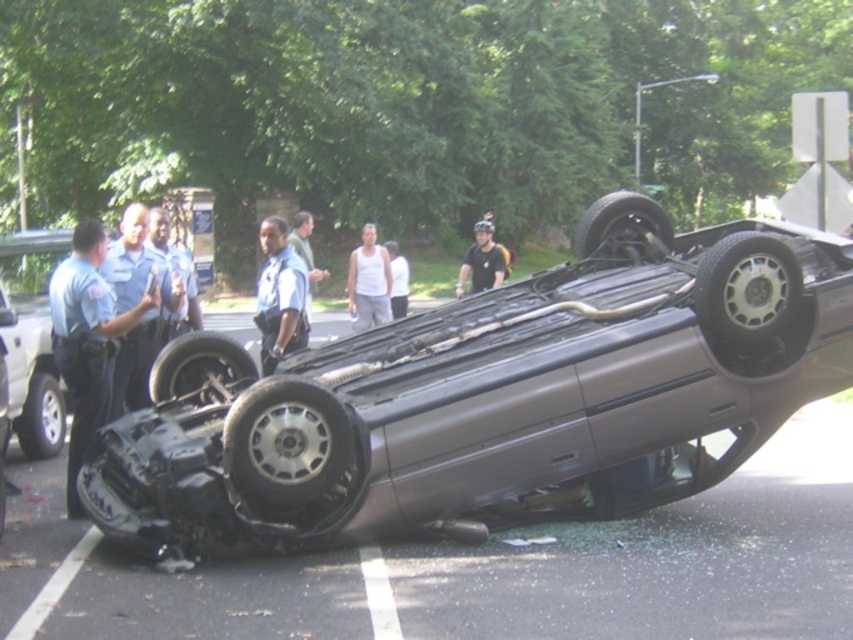
Question: In this image, where is white tank top at center located relative to black matte helmet at upper center?

Choices:
 (A) above
 (B) below

Answer: (B)

Question: Which object appears closest to the camera in this image?

Choices:
 (A) blue uniform shirt at center
 (B) blue uniform at left

Answer: (B)

Question: Which object is closer to the camera taking this photo?

Choices:
 (A) blue uniform at left
 (B) dark blue uniform at left
 (C) silver metallic car at left

Answer: (B)

Question: Can you confirm if white tank top at center is positioned below black matte helmet at upper center?

Choices:
 (A) yes
 (B) no

Answer: (A)

Question: Which point appears farthest from the camera in this image?

Choices:
 (A) (39, 234)
 (B) (263, 304)

Answer: (A)

Question: Does dark blue uniform at left have a greater width compared to black matte helmet at upper center?

Choices:
 (A) yes
 (B) no

Answer: (B)